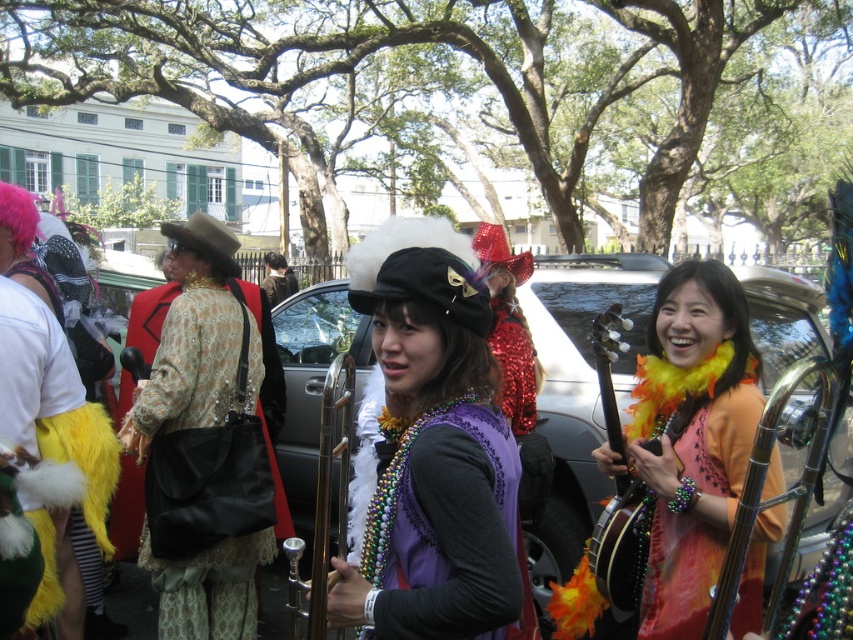
Question: Where is purple velvet vest at center located in relation to gold sequined jacket at center in the image?

Choices:
 (A) left
 (B) right

Answer: (B)

Question: Which of the following is the closest to the observer?

Choices:
 (A) shiny sequin dress at center
 (B) matte gold jacket at center
 (C) wooden banjo at center

Answer: (C)

Question: Does purple velvet vest at center have a smaller size compared to shiny sequin dress at center?

Choices:
 (A) no
 (B) yes

Answer: (B)

Question: Which point is farther to the camera?

Choices:
 (A) (662, 577)
 (B) (601, 410)
 (C) (287, 269)
 (D) (227, 292)

Answer: (C)

Question: Considering the real-world distances, which object is closest to the orange feather boa at center?

Choices:
 (A) wooden banjo at center
 (B) purple velvet vest at center
 (C) matte gold jacket at center
 (D) gold sequined jacket at center

Answer: (A)

Question: Can you confirm if shiny sequin dress at center is positioned above gold sequined jacket at center?

Choices:
 (A) no
 (B) yes

Answer: (A)